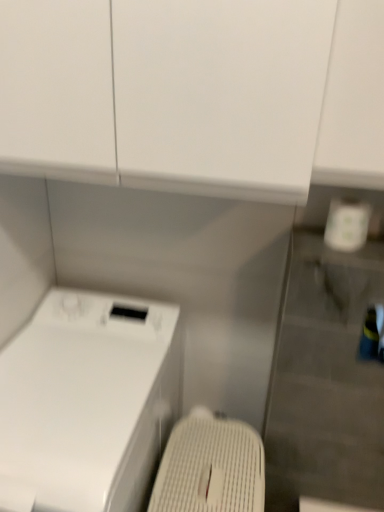
The width and height of the screenshot is (384, 512). Find the location of `empty space that is ontop of white textured washing machine at lower center`. empty space that is ontop of white textured washing machine at lower center is located at coordinates (215, 454).